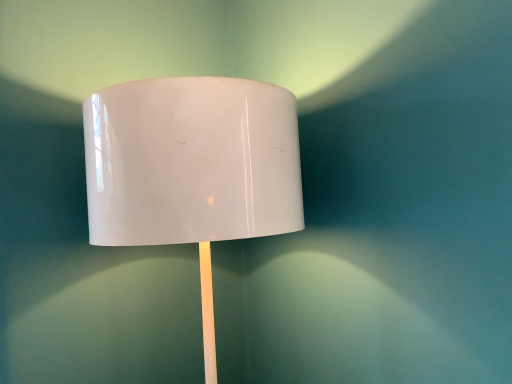
Where is `glossy white lampshade at center`? glossy white lampshade at center is located at coordinates (192, 168).

What do you see at coordinates (192, 168) in the screenshot?
I see `glossy white lampshade at center` at bounding box center [192, 168].

The width and height of the screenshot is (512, 384). I want to click on glossy white lampshade at center, so click(192, 168).